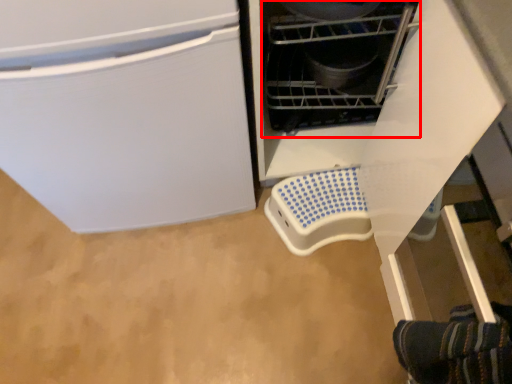
Question: From the image's perspective, where is appliance (annotated by the red box) located in relation to appliance in the image?

Choices:
 (A) below
 (B) above

Answer: (B)